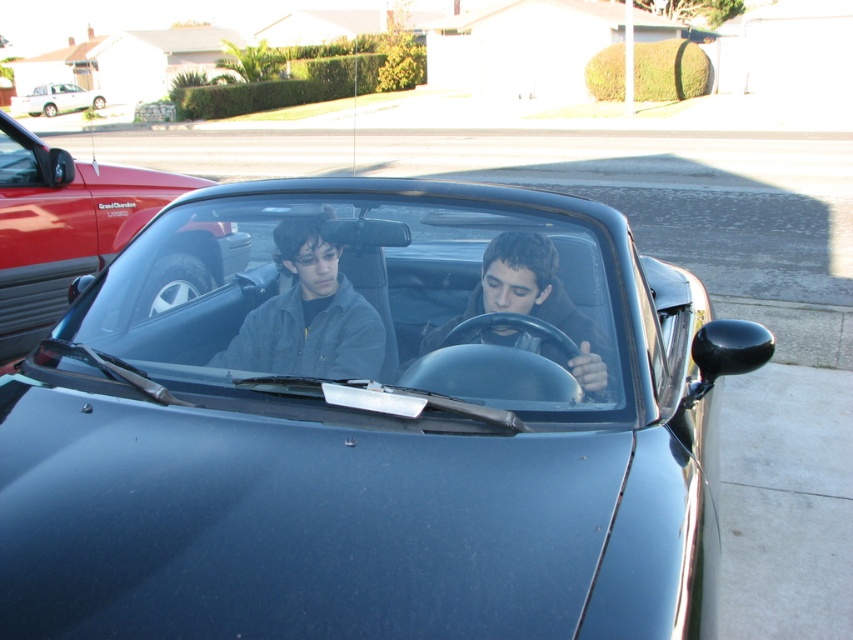
You are a delivery person trying to locate the shiny black convertible at center. According to the coordinates provided, where should you look in the image to find it?

The shiny black convertible at center is located at the 2D coordinates point (62, 227) in the image.

You are a delivery person trying to place a package on the roof of the car. The package is 1 meter long. Can you determine if the transparent glass windshield at center will block the placement of the package?

The transparent glass windshield at center is located at point (364, 296), so it is positioned in the center of the car. Since the package is 1 meter long, it might extend beyond the windshield area. However, without knowing the exact dimensions of the car roof, it is uncertain if the windshield will block the placement. Please check the car roof length before deciding.